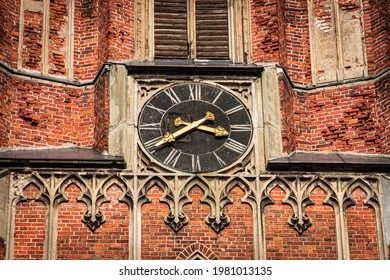
Where is `shutters`? This screenshot has width=390, height=280. shutters is located at coordinates (173, 27), (216, 46), (324, 49), (344, 42), (65, 32), (42, 48).